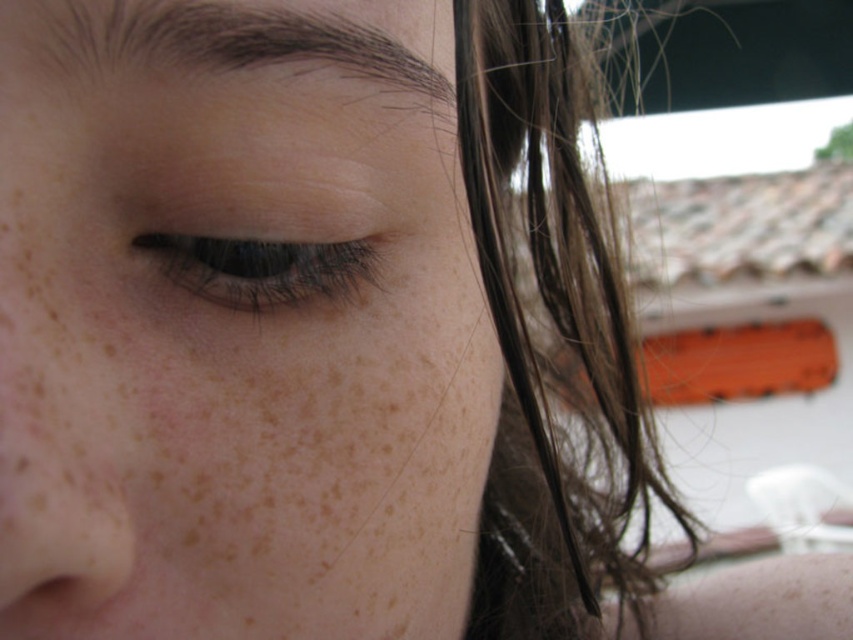
Question: Which object appears farthest from the camera in this image?

Choices:
 (A) brown matte eye at upper left
 (B) brown silky hair at right

Answer: (B)

Question: Does brown silky hair at right appear on the left side of brown matte eye at upper left?

Choices:
 (A) yes
 (B) no

Answer: (B)

Question: Where is freckled skin at center located in relation to brown silky hair at right in the image?

Choices:
 (A) right
 (B) left

Answer: (B)

Question: Which object is positioned closest to the brown silky hair at right?

Choices:
 (A) freckled skin at center
 (B) brown matte eye at upper left

Answer: (A)

Question: Is smooth skin nose at lower left positioned behind brown matte eye at upper left?

Choices:
 (A) yes
 (B) no

Answer: (B)

Question: Which point appears closest to the camera in this image?

Choices:
 (A) (18, 468)
 (B) (115, 321)

Answer: (A)